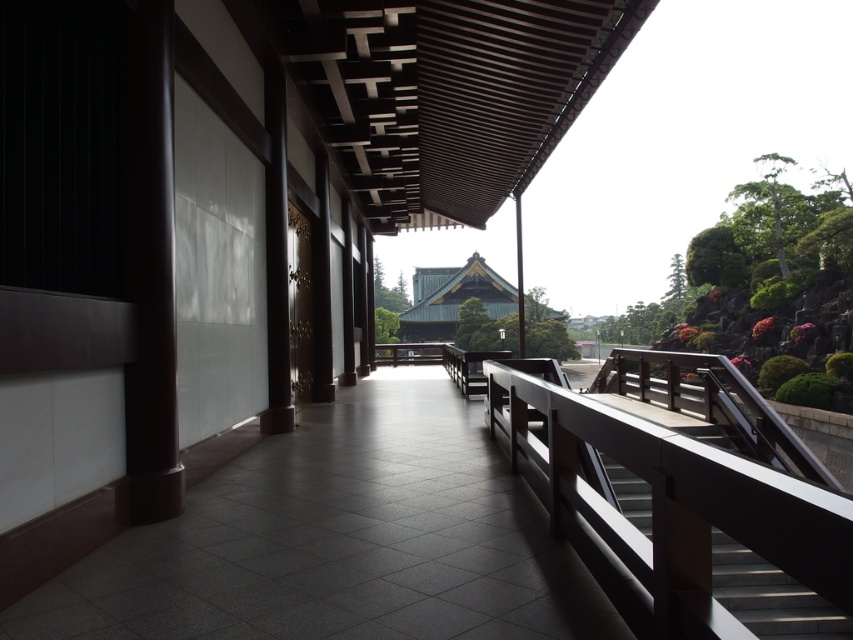
Does smooth concrete path at center come in front of smooth brown wooden rail at right?

No, it is not.

Which of these two, smooth concrete path at center or smooth brown wooden rail at right, stands taller?

smooth brown wooden rail at right

Which is in front, point (416, 532) or point (816, 582)?

Point (816, 582) is in front.

I want to click on smooth concrete path at center, so click(340, 540).

Looking at this image, between smooth brown wooden rail at right and smooth wooden stair at center, which one has less height?

smooth wooden stair at center is shorter.

Is smooth brown wooden rail at right wider than smooth wooden stair at center?

Indeed, smooth brown wooden rail at right has a greater width compared to smooth wooden stair at center.

Image resolution: width=853 pixels, height=640 pixels. I want to click on smooth brown wooden rail at right, so click(x=680, y=499).

Measure the distance between smooth concrete path at center and smooth wooden stair at center.

smooth concrete path at center and smooth wooden stair at center are 21.53 feet apart from each other.

Who is taller, smooth concrete path at center or smooth wooden stair at center?

smooth concrete path at center is taller.

Measure the distance between smooth concrete path at center and camera.

smooth concrete path at center and camera are 8.31 feet apart.

The height and width of the screenshot is (640, 853). Find the location of `smooth concrete path at center`. smooth concrete path at center is located at coordinates (340, 540).